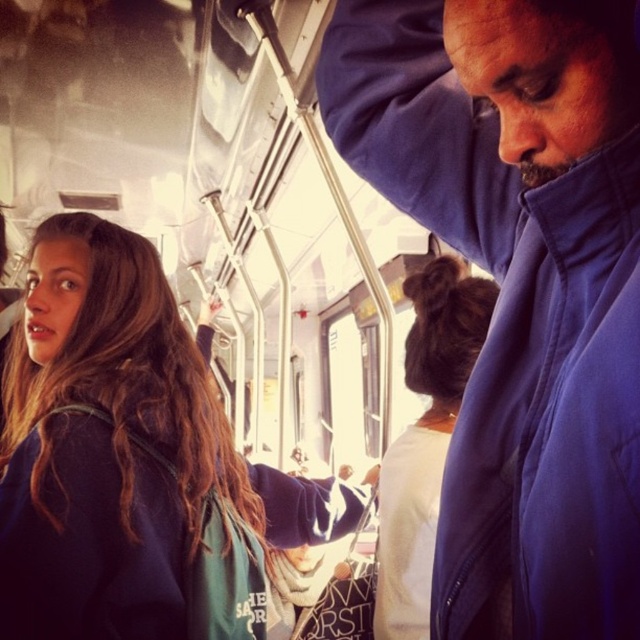
Between blue fleece jacket at upper right and brown fuzzy hair at upper center, which one has less height?

blue fleece jacket at upper right is shorter.

What do you see at coordinates (518, 285) in the screenshot? I see `blue fleece jacket at upper right` at bounding box center [518, 285].

Measure the distance between blue fleece jacket at upper right and camera.

The distance of blue fleece jacket at upper right from camera is 18.29 inches.

Find the location of a particular element. This screenshot has height=640, width=640. blue fleece jacket at upper right is located at coordinates (518, 285).

Does blue fleece jacket at upper right have a lesser height compared to brown hair at upper left?

No, blue fleece jacket at upper right is not shorter than brown hair at upper left.

Is blue fleece jacket at upper right to the right of brown hair at upper left from the viewer's perspective?

Correct, you'll find blue fleece jacket at upper right to the right of brown hair at upper left.

Is point (538, 593) positioned after point (29, 508)?

No, (538, 593) is closer to viewer.

In order to click on blue fleece jacket at upper right in this screenshot , I will do `click(518, 285)`.

Measure the distance between point [58,541] and camera.

Point [58,541] is 35.89 inches from camera.

Locate an element on the screen. This screenshot has width=640, height=640. brown hair at upper left is located at coordinates (131, 461).

In order to click on brown hair at upper left in this screenshot , I will do `click(131, 461)`.